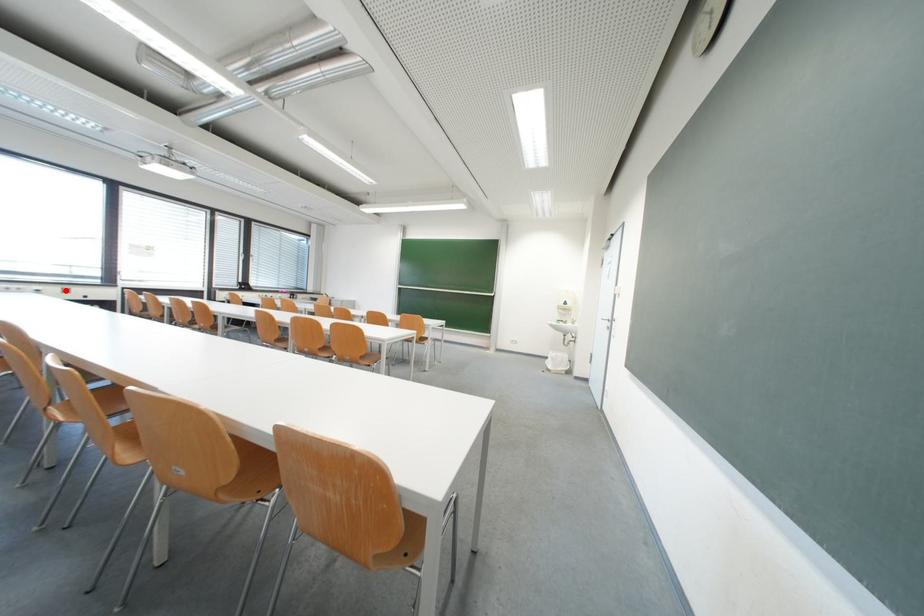
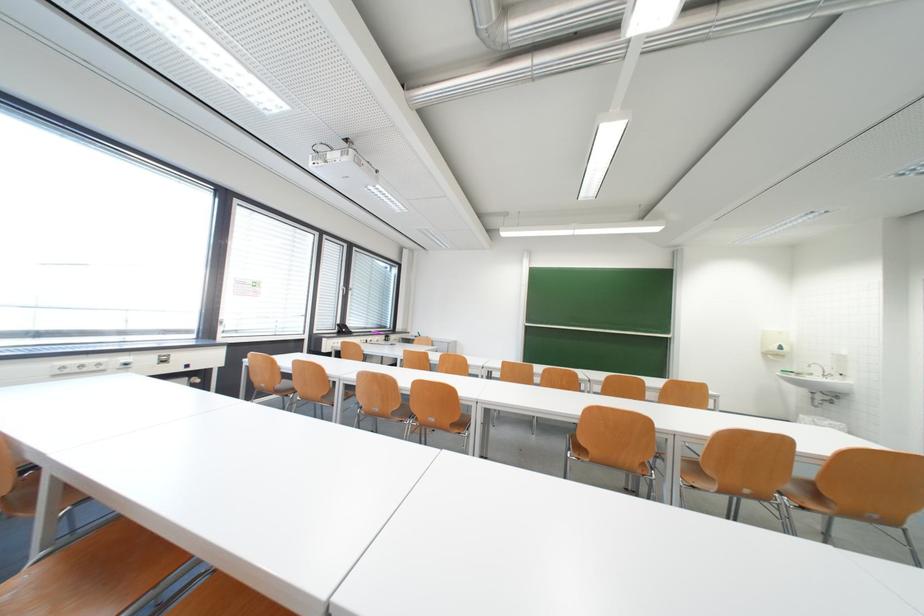
Find the pixel in the second image that matches the highlighted location in the first image.

(160, 359)